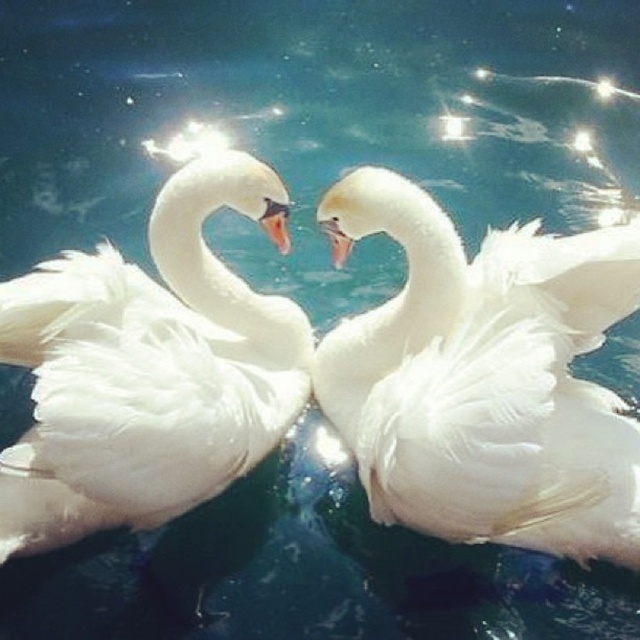
Question: Is white fluffy swan at center in front of white fluffy swan at left?

Choices:
 (A) yes
 (B) no

Answer: (B)

Question: Which point is farther from the camera taking this photo?

Choices:
 (A) click(416, 208)
 (B) click(106, 348)

Answer: (A)

Question: Can you confirm if white fluffy swan at center is positioned to the left of white fluffy swan at left?

Choices:
 (A) no
 (B) yes

Answer: (A)

Question: Can you confirm if white fluffy swan at center is smaller than white fluffy swan at left?

Choices:
 (A) no
 (B) yes

Answer: (A)

Question: Which point is farther to the camera?

Choices:
 (A) (212, 268)
 (B) (483, 429)

Answer: (A)

Question: Which point is closer to the camera?

Choices:
 (A) (147, 360)
 (B) (605, 486)

Answer: (A)